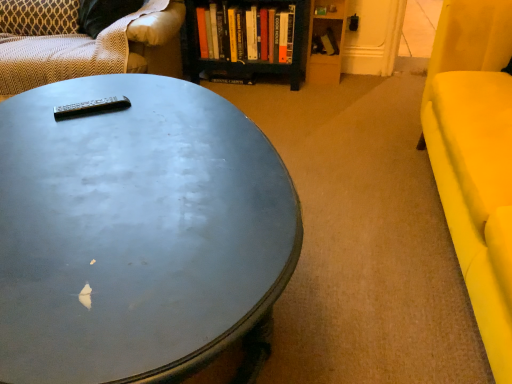
Question: Considering the relative sizes of patterned fabric studio couch at upper left and black plastic remote at center in the image provided, is patterned fabric studio couch at upper left smaller than black plastic remote at center?

Choices:
 (A) yes
 (B) no

Answer: (B)

Question: Considering the relative sizes of patterned fabric studio couch at upper left and black plastic remote at center in the image provided, is patterned fabric studio couch at upper left shorter than black plastic remote at center?

Choices:
 (A) yes
 (B) no

Answer: (B)

Question: From the image's perspective, is patterned fabric studio couch at upper left under black plastic remote at center?

Choices:
 (A) yes
 (B) no

Answer: (B)

Question: From a real-world perspective, does patterned fabric studio couch at upper left stand above black plastic remote at center?

Choices:
 (A) yes
 (B) no

Answer: (B)

Question: Does patterned fabric studio couch at upper left turn towards black plastic remote at center?

Choices:
 (A) yes
 (B) no

Answer: (B)

Question: Would you say hardcover book at center is inside or outside black plastic remote at center?

Choices:
 (A) inside
 (B) outside

Answer: (B)

Question: In terms of size, does hardcover book at center appear bigger or smaller than black plastic remote at center?

Choices:
 (A) small
 (B) big

Answer: (B)

Question: Relative to black plastic remote at center, is hardcover book at center in front or behind?

Choices:
 (A) behind
 (B) front

Answer: (A)

Question: From a real-world perspective, is hardcover book at center positioned above or below black plastic remote at center?

Choices:
 (A) above
 (B) below

Answer: (B)

Question: In terms of height, does metallic gray coffee table at center look taller or shorter compared to patterned fabric studio couch at upper left?

Choices:
 (A) short
 (B) tall

Answer: (B)

Question: Considering the positions of metallic gray coffee table at center and patterned fabric studio couch at upper left in the image, is metallic gray coffee table at center wider or thinner than patterned fabric studio couch at upper left?

Choices:
 (A) thin
 (B) wide

Answer: (B)

Question: Is point (204, 266) positioned closer to the camera than point (7, 81)?

Choices:
 (A) farther
 (B) closer

Answer: (B)

Question: Choose the correct answer: Is metallic gray coffee table at center inside patterned fabric studio couch at upper left or outside it?

Choices:
 (A) inside
 (B) outside

Answer: (B)

Question: Is patterned fabric studio couch at upper left wider or thinner than matte yellow armchair at right?

Choices:
 (A) wide
 (B) thin

Answer: (A)

Question: Is point (166, 1) closer or farther from the camera than point (503, 36)?

Choices:
 (A) farther
 (B) closer

Answer: (A)